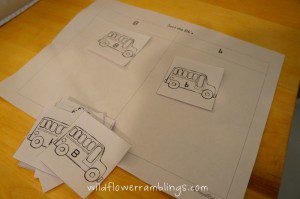
Image resolution: width=300 pixels, height=199 pixels. I want to click on table top to th eleft of the paper, so click(x=28, y=41).